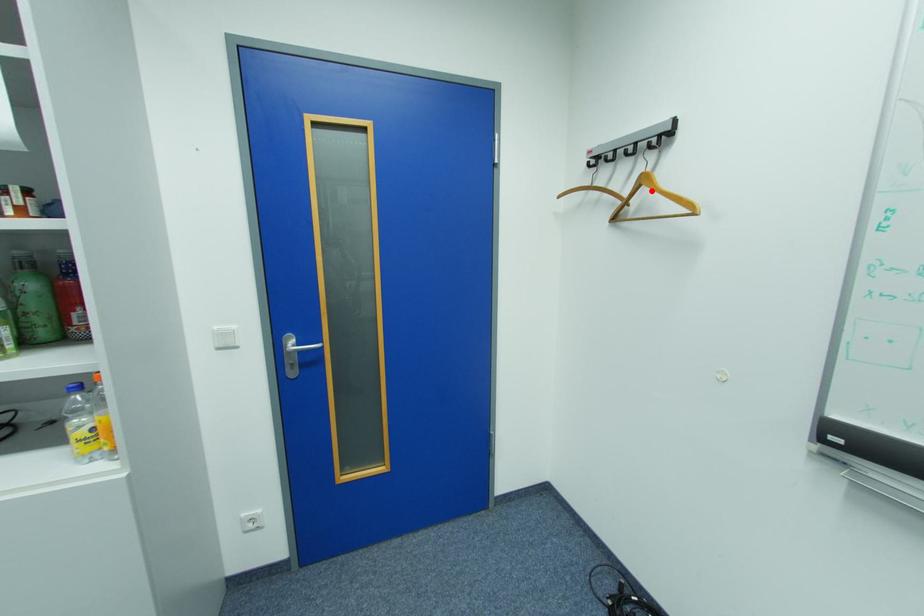
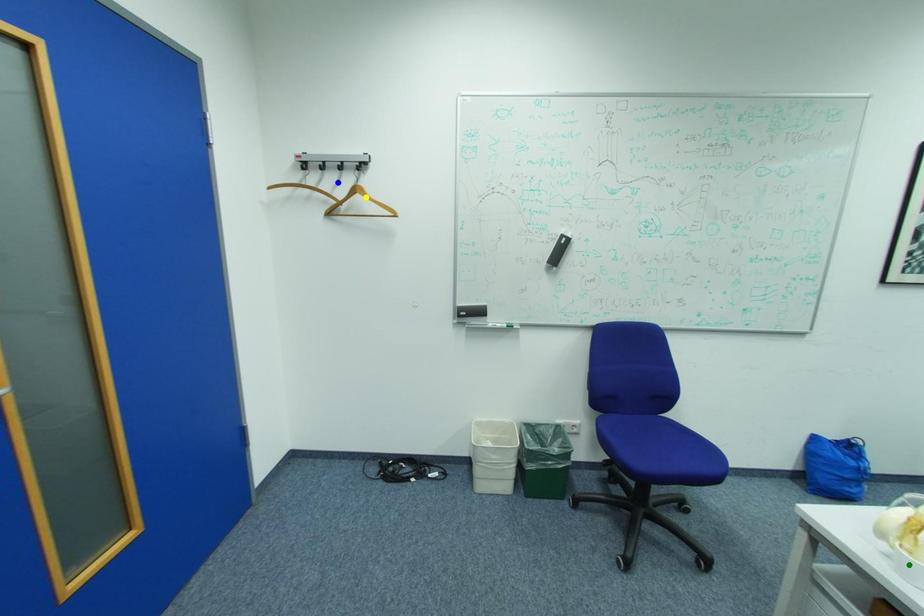
Question: I am providing you with two images of the same scene from different viewpoints. A red point is marked on the first image. You are given multiple points on the second image. Which point in image 2 represents the same 3d spot as the red point in image 1?

Choices:
 (A) blue point
 (B) yellow point
 (C) green point

Answer: (B)